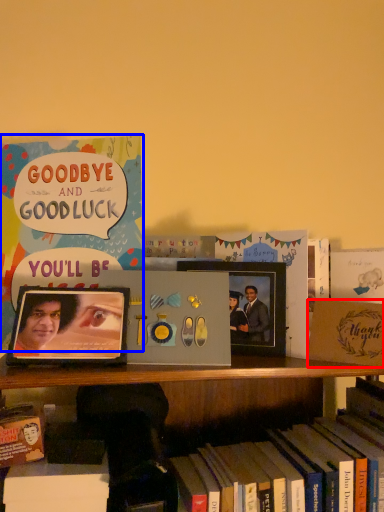
Question: Which object is closer to the camera taking this photo, paperback book (highlighted by a red box) or book (highlighted by a blue box)?

Choices:
 (A) paperback book
 (B) book

Answer: (A)